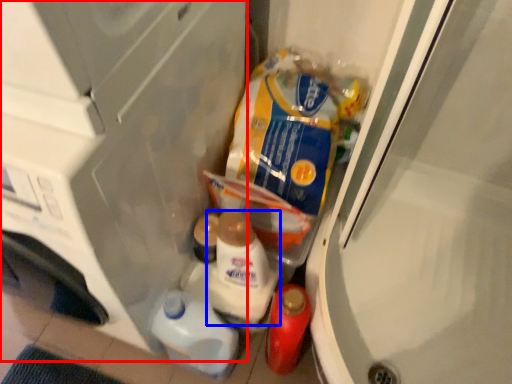
Question: Which object is further to the camera taking this photo, appliance (highlighted by a red box) or snack (highlighted by a blue box)?

Choices:
 (A) appliance
 (B) snack

Answer: (B)